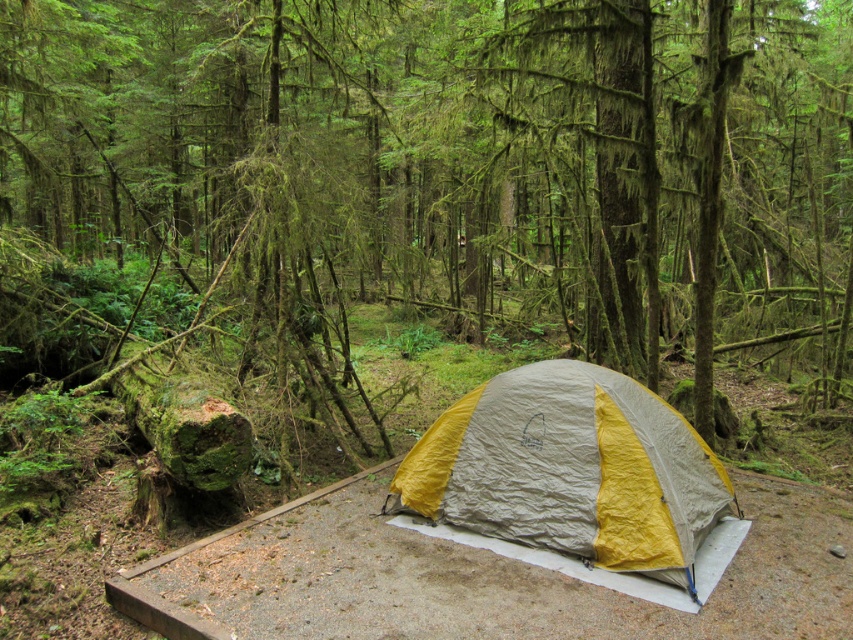
You are standing at the point where the viewer is located in the forest scene. There is a specific point marked at coordinates point [418,120]. If you want to place a 10 feet long hiking pole from your current position to that point, will it reach?

The distance between the viewer and point [418,120] is 43.93 feet, which is greater than the 10 feet length of the hiking pole. Therefore, the pole will not reach.

You are planning to set up a small garden between the green mossy tree at center and the yellow fabric tent at center. Which object should you place the garden closer to in order to ensure it has enough space to grow?

The green mossy tree at center is wider than the yellow fabric tent at center, so placing the garden closer to the yellow fabric tent at center will provide more space for growth.

You are a camper who wants to set up a hammock between the green mossy tree at center and the yellow fabric tent at center. Considering their sizes, which object would you choose as the anchor point for the hammock?

The green mossy tree at center has a larger size compared to the yellow fabric tent at center, so it would be the better anchor point for the hammock due to its sturdiness and stability.